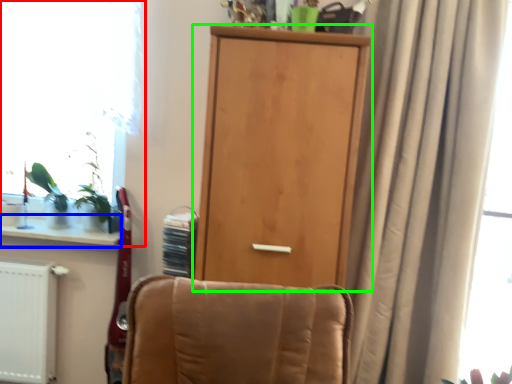
Question: Considering the real-world distances, which object is farthest from window (highlighted by a red box)? window sill (highlighted by a blue box) or door (highlighted by a green box)?

Choices:
 (A) window sill
 (B) door

Answer: (B)